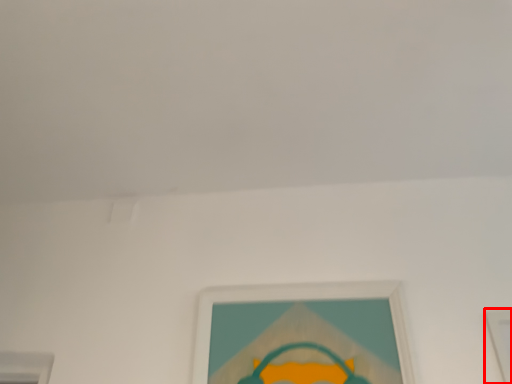
Question: Where is picture frame (annotated by the red box) located in relation to picture frame in the image?

Choices:
 (A) right
 (B) left

Answer: (A)